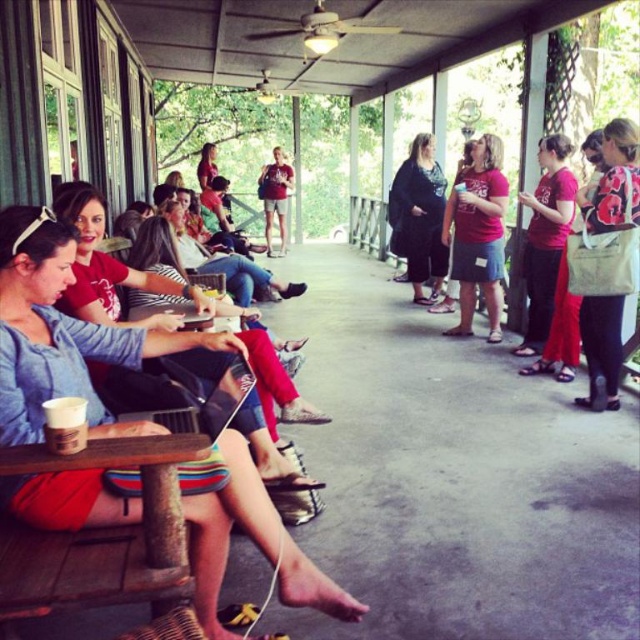
Question: In this image, where is matte black laptop at left located relative to printed cotton shirt at center?

Choices:
 (A) left
 (B) right

Answer: (A)

Question: Can you confirm if matte black laptop at left is positioned above matte red shirt at center?

Choices:
 (A) no
 (B) yes

Answer: (A)

Question: Among these points, which one is farthest from the camera?

Choices:
 (A) (417, 232)
 (B) (582, 332)
 (C) (268, 380)

Answer: (A)

Question: Which point is farther from the camera taking this photo?

Choices:
 (A) (280, 216)
 (B) (422, 166)
 (C) (259, 372)

Answer: (A)

Question: Is matte red shirt at center to the left of black matte dress at center from the viewer's perspective?

Choices:
 (A) yes
 (B) no

Answer: (B)

Question: Which object is positioned farthest from the printed cotton shirt at center?

Choices:
 (A) matte red shirt at center
 (B) matte black laptop at left
 (C) matte pink shorts at center
 (D) red cotton t-shirt at center

Answer: (C)